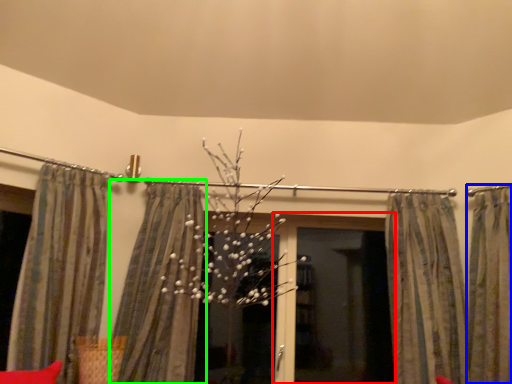
Question: Which object is the farthest from screen door (highlighted by a red box)? Choose among these: curtain (highlighted by a blue box) or curtain (highlighted by a green box).

Choices:
 (A) curtain
 (B) curtain

Answer: (B)